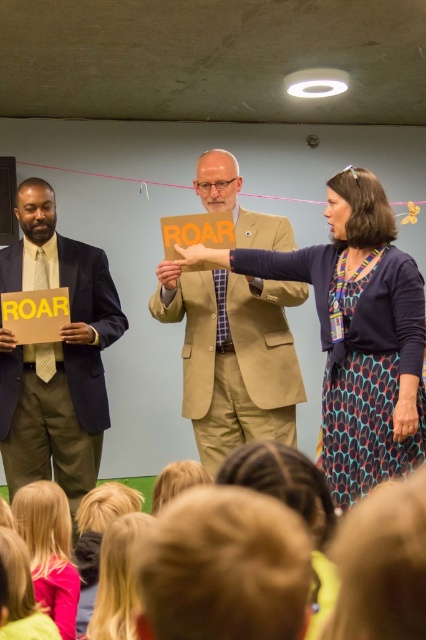
You are a photographer setting up for a group photo. You need to ensure that the matte orange sign at center and the tan fabric suit at center are clearly visible in the shot. Given that your camera has a minimum focus distance of 16 inches, will both objects be in focus?

The distance between the matte orange sign at center and tan fabric suit at center is 16.54 inches. Since the minimum focus distance is 16 inches, both objects will be within the focus range and clearly visible.

You are an event planner trying to ensure that the matte orange sign at center and the tan fabric suit at center are visible to the audience. Based on their sizes, which object would appear wider from the audience perspective?

The matte orange sign at center appears wider than the tan fabric suit at center because its width surpasses that of the tan fabric suit at center.

You are an attendee at a presentation and want to take a photo of the tan fabric suit at center and the matte orange sign at center. Which object should you focus on first if you want to capture both in the same frame without moving your camera?

The matte orange sign at center is positioned on the right side of tan fabric suit at center, so you should focus on the tan fabric suit at center first to ensure both are in the frame without moving the camera.